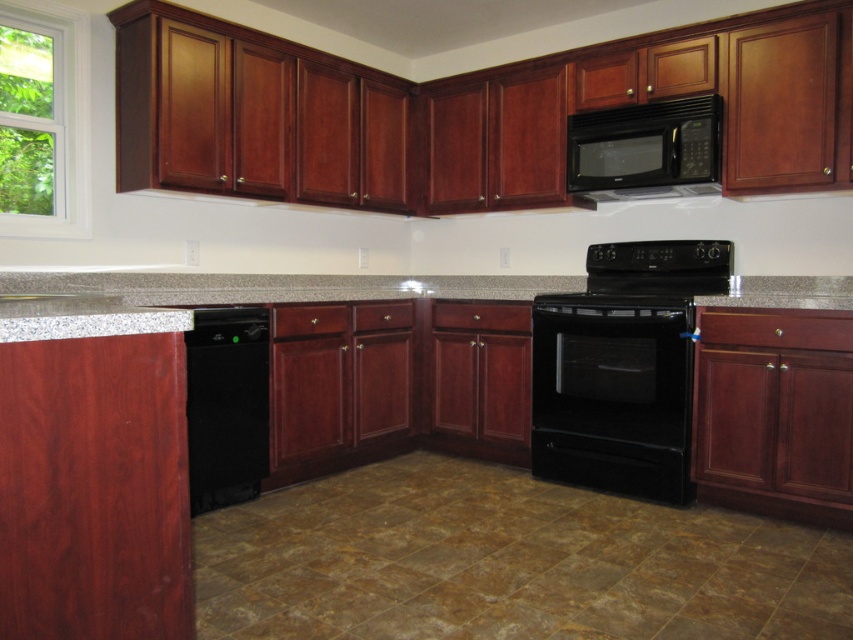
Question: Is black glass oven at center to the left of granite at center from the viewer's perspective?

Choices:
 (A) yes
 (B) no

Answer: (B)

Question: Can you confirm if black glass oven at center is bigger than black matte dishwasher at lower left?

Choices:
 (A) yes
 (B) no

Answer: (A)

Question: Among these points, which one is farthest from the camera?

Choices:
 (A) (26, 292)
 (B) (616, 170)
 (C) (596, 192)

Answer: (C)

Question: Based on their relative distances, which object is nearer to the granite at center?

Choices:
 (A) black glass exhaust hood at upper center
 (B) black matte dishwasher at lower left
 (C) gray granite sink at lower left

Answer: (B)

Question: Which point is closer to the camera taking this photo?

Choices:
 (A) (769, 298)
 (B) (595, 300)
 (C) (38, 304)

Answer: (C)

Question: Does black matte dishwasher at lower left have a larger size compared to gray granite sink at lower left?

Choices:
 (A) no
 (B) yes

Answer: (A)